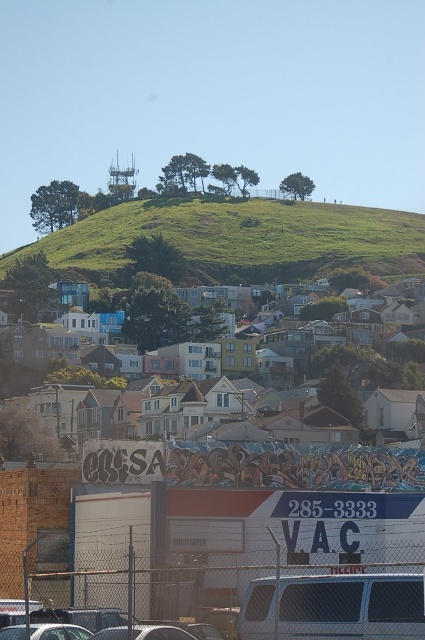
Question: Observing the image, what is the correct spatial positioning of green grassy hillside at center in reference to metallic silver van at lower center?

Choices:
 (A) below
 (B) above

Answer: (B)

Question: Which is farther from the metallic silver car at lower left?

Choices:
 (A) metal chain-link fence at lower center
 (B) matte pastel houses at center
 (C) metallic silver car at lower center
 (D) metallic silver van at lower center

Answer: (B)

Question: In this image, where is metallic silver van at lower center located relative to metallic silver car at lower center?

Choices:
 (A) below
 (B) above

Answer: (B)

Question: Can you confirm if metallic silver van at lower center is positioned above matte pastel houses at center?

Choices:
 (A) yes
 (B) no

Answer: (B)

Question: Which point is closer to the camera?

Choices:
 (A) (261, 582)
 (B) (48, 252)
 (C) (67, 621)

Answer: (A)

Question: Considering the real-world distances, which object is farthest from the metallic silver car at lower left?

Choices:
 (A) matte pastel houses at center
 (B) metal chain-link fence at lower center

Answer: (A)